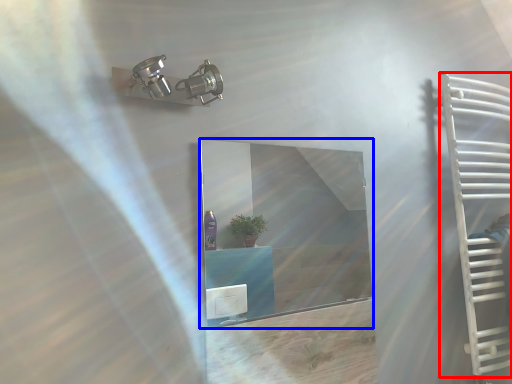
Question: Which of the following is the closest to the observer, ladder (highlighted by a red box) or mirror (highlighted by a blue box)?

Choices:
 (A) ladder
 (B) mirror

Answer: (B)